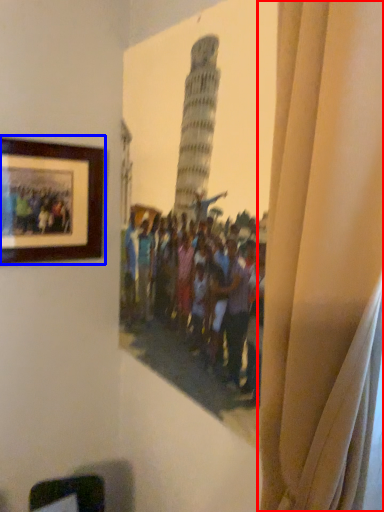
Question: Which object is closer to the camera taking this photo, curtain (highlighted by a red box) or picture frame (highlighted by a blue box)?

Choices:
 (A) curtain
 (B) picture frame

Answer: (A)